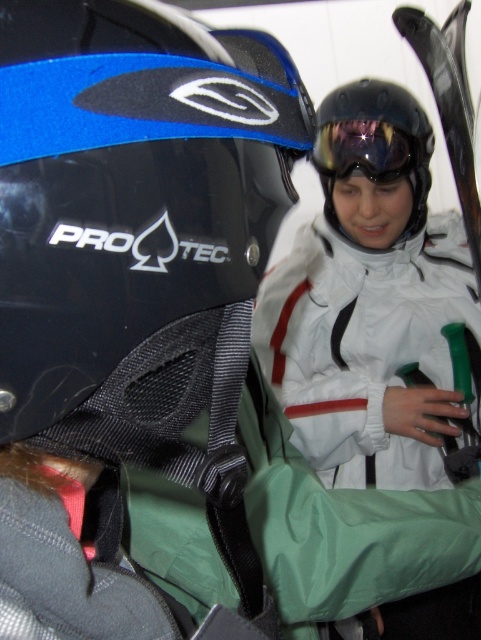
Question: Can you confirm if black matte helmet at left is positioned above glossy black goggles at center?

Choices:
 (A) no
 (B) yes

Answer: (A)

Question: Considering the real-world distances, which object is farthest from the white matte jacket at center?

Choices:
 (A) glossy black goggles at center
 (B) glossy black helmet at upper center

Answer: (A)

Question: Which point appears closest to the camera in this image?

Choices:
 (A) [395, 113]
 (B) [333, 168]

Answer: (A)

Question: Does black matte helmet at left come behind glossy black goggles at center?

Choices:
 (A) yes
 (B) no

Answer: (B)

Question: From the image, what is the correct spatial relationship of white matte jacket at center in relation to glossy black helmet at upper center?

Choices:
 (A) below
 (B) above

Answer: (A)

Question: Among these objects, which one is farthest from the camera?

Choices:
 (A) glossy black helmet at upper center
 (B) glossy black goggles at center
 (C) white matte jacket at center

Answer: (B)